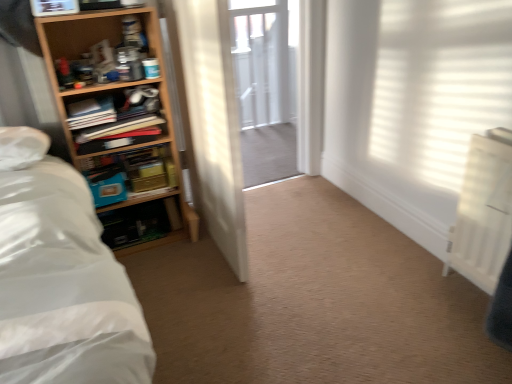
Identify the location of white painted wood door at center. (212, 122).

What do you see at coordinates (121, 123) in the screenshot? The image size is (512, 384). I see `wooden bookshelf at left, which is the second shelf in top-to-bottom order` at bounding box center [121, 123].

In the scene shown: What is the approximate width of wooden bookshelf at left, the 3th shelf in the bottom-to-top sequence?

11.31 inches.

Locate an element on the screen. The width and height of the screenshot is (512, 384). clear glass screen door at center is located at coordinates (266, 86).

Considering the positions of points (172, 147) and (184, 60), is point (172, 147) closer to camera compared to point (184, 60)?

No.

Image resolution: width=512 pixels, height=384 pixels. Find the location of `door on the right side of wooden bookshelf at left, which is the second shelf in top-to-bottom order`. door on the right side of wooden bookshelf at left, which is the second shelf in top-to-bottom order is located at coordinates (212, 122).

Between wooden bookshelf at left, which is the second shelf in top-to-bottom order, and white painted wood door at center, which one has larger size?

white painted wood door at center.

Can you tell me how much wooden bookshelf at left, positioned as the third shelf in top-to-bottom order, and white painted wood door at center differ in facing direction?

The angle between the facing direction of wooden bookshelf at left, positioned as the third shelf in top-to-bottom order, and the facing direction of white painted wood door at center is 3.34 degrees.

Is wooden bookshelf at left, positioned as the third shelf in top-to-bottom order, shorter than white painted wood door at center?

Yes, wooden bookshelf at left, positioned as the third shelf in top-to-bottom order, is shorter than white painted wood door at center.

In terms of width, does wooden bookshelf at left, positioned as the 1th shelf in bottom-to-top order, look wider or thinner when compared to white painted wood door at center?

wooden bookshelf at left, positioned as the 1th shelf in bottom-to-top order, is thinner than white painted wood door at center.

In the scene shown: Is wooden bookshelf at left, positioned as the third shelf in top-to-bottom order, positioned with its back to white painted wood door at center?

No, white painted wood door at center is not at the back of wooden bookshelf at left, positioned as the third shelf in top-to-bottom order.

Is white painted wood door at center spatially inside wooden bookshelf at left, positioned as the 1th shelf in bottom-to-top order, or outside of it?

white painted wood door at center is not enclosed by wooden bookshelf at left, positioned as the 1th shelf in bottom-to-top order.

Relative to wooden bookshelf at left, positioned as the third shelf in top-to-bottom order, is white painted wood door at center in front or behind?

Result: white painted wood door at center is in front of wooden bookshelf at left, positioned as the third shelf in top-to-bottom order.

From a real-world perspective, is white painted wood door at center above or below wooden bookshelf at left, positioned as the third shelf in top-to-bottom order?

white painted wood door at center is situated higher than wooden bookshelf at left, positioned as the third shelf in top-to-bottom order, in the real world.

Between point (168, 19) and point (113, 164), which one is positioned behind?

Positioned behind is point (113, 164).

Between white painted wood door at center and wooden bookshelf at left, which is the 1th shelf from top to bottom, which one is positioned in front?

white painted wood door at center is in front.

Is white painted wood door at center positioned with its back to wooden bookshelf at left, the 3th shelf in the bottom-to-top sequence?

No, white painted wood door at center's orientation is not away from wooden bookshelf at left, the 3th shelf in the bottom-to-top sequence.

From a real-world perspective, is white painted wood door at center physically below wooden bookshelf at left, which is the 1th shelf from top to bottom?

Yes, from a real-world perspective, white painted wood door at center is below wooden bookshelf at left, which is the 1th shelf from top to bottom.

Identify the location of door to the right of wooden bookshelf at left, which is the 1th shelf from top to bottom. (212, 122).

In the scene shown: Is wooden bookshelf at left, positioned as the third shelf in top-to-bottom order, far away from wooden bookshelf at left, the 3th shelf in the bottom-to-top sequence?

They are positioned close to each other.

Which object is positioned more to the right, wooden bookshelf at left, positioned as the 1th shelf in bottom-to-top order, or wooden bookshelf at left, which is the 1th shelf from top to bottom?

From the viewer's perspective, wooden bookshelf at left, positioned as the 1th shelf in bottom-to-top order, appears more on the right side.

Is wooden bookshelf at left, positioned as the 1th shelf in bottom-to-top order, behind wooden bookshelf at left, the 3th shelf in the bottom-to-top sequence?

Yes, wooden bookshelf at left, positioned as the 1th shelf in bottom-to-top order, is further from the viewer.

Considering the positions of points (125, 151) and (84, 104), is point (125, 151) farther from camera compared to point (84, 104)?

Yes.

The image size is (512, 384). I want to click on shelf that is the 3rd one when counting forward from the clear glass screen door at center, so click(121, 123).

Can you confirm if clear glass screen door at center is thinner than wooden bookshelf at left, which is counted as the second shelf, starting from the bottom?

Yes.

Does point (292, 169) come behind point (60, 102)?

That is True.

Which is more to the left, clear glass screen door at center or wooden bookshelf at left, which is counted as the second shelf, starting from the bottom?

wooden bookshelf at left, which is counted as the second shelf, starting from the bottom, is more to the left.

Can wooden bookshelf at left, positioned as the 1th shelf in bottom-to-top order, be found inside clear glass screen door at center?

No, wooden bookshelf at left, positioned as the 1th shelf in bottom-to-top order, is not inside clear glass screen door at center.

From a real-world perspective, which is physically below, clear glass screen door at center or wooden bookshelf at left, positioned as the third shelf in top-to-bottom order?

In real-world perspective, wooden bookshelf at left, positioned as the third shelf in top-to-bottom order, is lower.

Is clear glass screen door at center touching wooden bookshelf at left, positioned as the 1th shelf in bottom-to-top order?

No, clear glass screen door at center is not next to wooden bookshelf at left, positioned as the 1th shelf in bottom-to-top order.

Between clear glass screen door at center and wooden bookshelf at left, positioned as the third shelf in top-to-bottom order, which one is positioned behind?

clear glass screen door at center is more distant.

Locate an element on the screen. This screenshot has height=384, width=512. shelf that is the 1st one when counting backward from the white painted wood door at center is located at coordinates (121, 123).

Where is `door positioned vertically above the wooden bookshelf at left, positioned as the 1th shelf in bottom-to-top order (from a real-world perspective)`? This screenshot has height=384, width=512. door positioned vertically above the wooden bookshelf at left, positioned as the 1th shelf in bottom-to-top order (from a real-world perspective) is located at coordinates (212, 122).

Looking at the image, which one is located closer to wooden bookshelf at left, the 3th shelf in the bottom-to-top sequence, wooden bookshelf at left, which is counted as the second shelf, starting from the bottom, or white painted wood door at center?

wooden bookshelf at left, which is counted as the second shelf, starting from the bottom.

Looking at the image, which one is located further to wooden bookshelf at left, positioned as the third shelf in top-to-bottom order, wooden bookshelf at left, which is the 1th shelf from top to bottom, or white painted wood door at center?

white painted wood door at center.

Which object lies nearer to the anchor point wooden bookshelf at left, which is counted as the second shelf, starting from the bottom, wooden bookshelf at left, positioned as the third shelf in top-to-bottom order, or white painted wood door at center?

wooden bookshelf at left, positioned as the third shelf in top-to-bottom order, is closer to wooden bookshelf at left, which is counted as the second shelf, starting from the bottom.

Based on the photo, considering their positions, is wooden bookshelf at left, which is counted as the second shelf, starting from the bottom, positioned further to clear glass screen door at center than white painted wood door at center?

Among the two, wooden bookshelf at left, which is counted as the second shelf, starting from the bottom, is located further to clear glass screen door at center.

Looking at the image, which one is located further to white painted wood door at center, wooden bookshelf at left, positioned as the third shelf in top-to-bottom order, or wooden bookshelf at left, the 3th shelf in the bottom-to-top sequence?

Based on the image, wooden bookshelf at left, positioned as the third shelf in top-to-bottom order, appears to be further to white painted wood door at center.

Looking at the image, which one is located closer to clear glass screen door at center, wooden bookshelf at left, positioned as the 1th shelf in bottom-to-top order, or wooden bookshelf at left, which is the second shelf in top-to-bottom order?

Among the two, wooden bookshelf at left, which is the second shelf in top-to-bottom order, is located nearer to clear glass screen door at center.

Considering their positions, is wooden bookshelf at left, which is the second shelf in top-to-bottom order, positioned closer to white painted wood door at center than wooden bookshelf at left, which is the 1th shelf from top to bottom?

Among the two, wooden bookshelf at left, which is the second shelf in top-to-bottom order, is located nearer to white painted wood door at center.

Which object lies nearer to the anchor point wooden bookshelf at left, positioned as the 1th shelf in bottom-to-top order, clear glass screen door at center or wooden bookshelf at left, the 3th shelf in the bottom-to-top sequence?

The object closer to wooden bookshelf at left, positioned as the 1th shelf in bottom-to-top order, is wooden bookshelf at left, the 3th shelf in the bottom-to-top sequence.

The height and width of the screenshot is (384, 512). I want to click on shelf between wooden bookshelf at left, which is counted as the second shelf, starting from the bottom, and wooden bookshelf at left, positioned as the 1th shelf in bottom-to-top order, in the front-back direction, so click(121, 119).

At what (x,y) coordinates should I click in order to perform the action: click on shelf between wooden bookshelf at left, which is the second shelf in top-to-bottom order, and clear glass screen door at center. Please return your answer as a coordinate pair (x, y). Looking at the image, I should click on (131, 173).